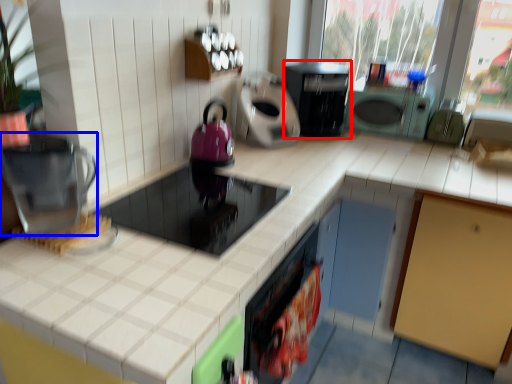
Question: Which point is closer to the camera, home appliance (highlighted by a red box) or kitchen appliance (highlighted by a blue box)?

Choices:
 (A) home appliance
 (B) kitchen appliance

Answer: (B)